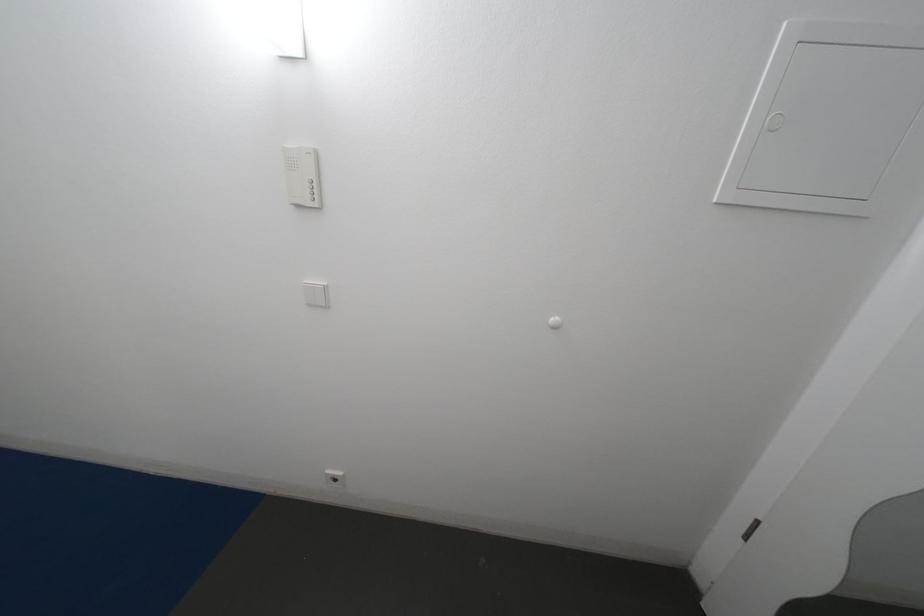
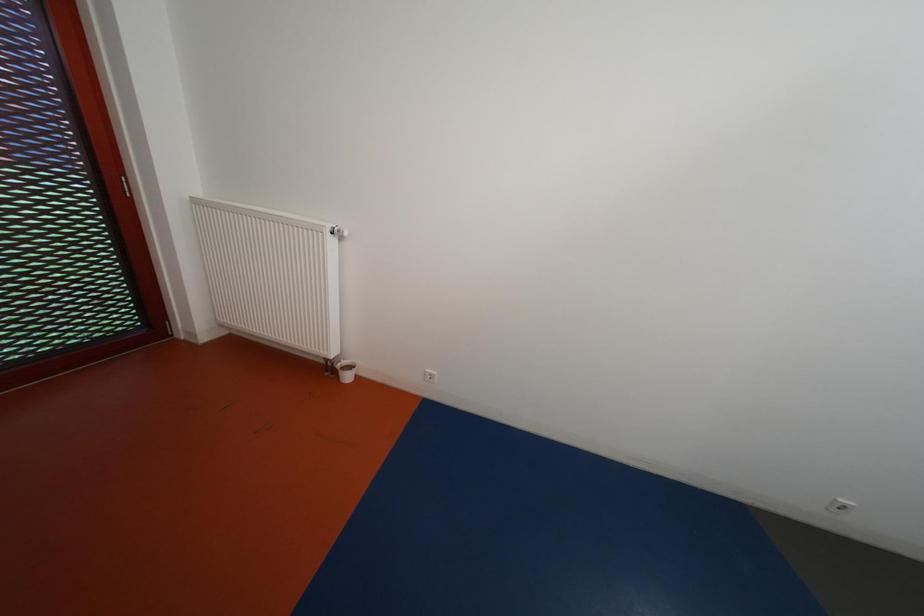
Question: What movement of the cameraman would produce the second image?

Choices:
 (A) Left
 (B) Right
 (C) Forward
 (D) Backward

Answer: (A)